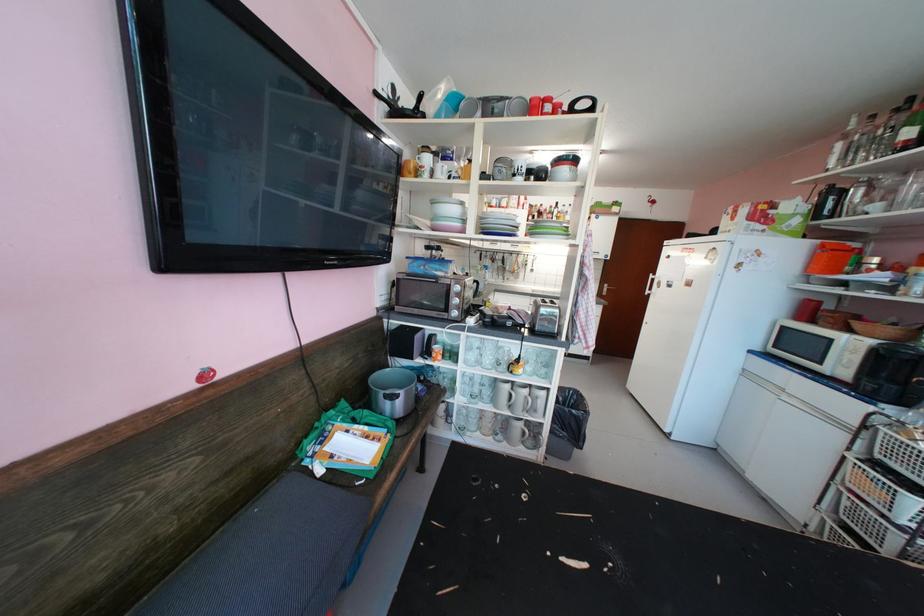
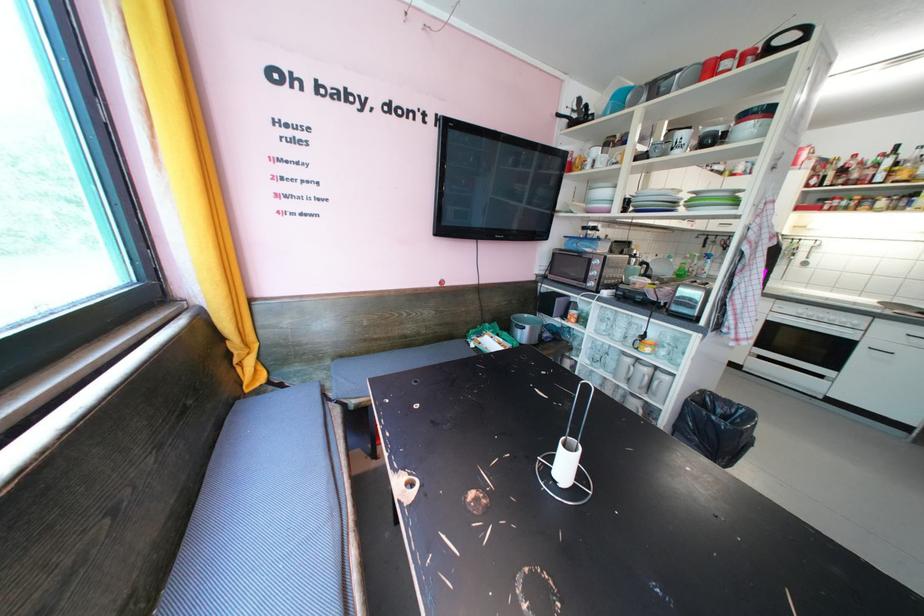
Question: How did the camera likely rotate?

Choices:
 (A) Left
 (B) Right
 (C) Up
 (D) Down

Answer: (A)